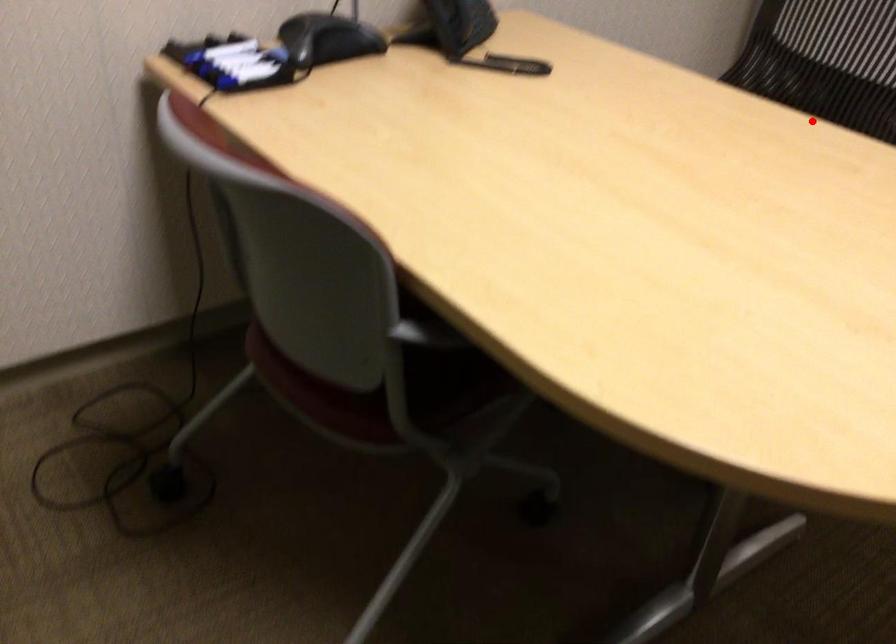
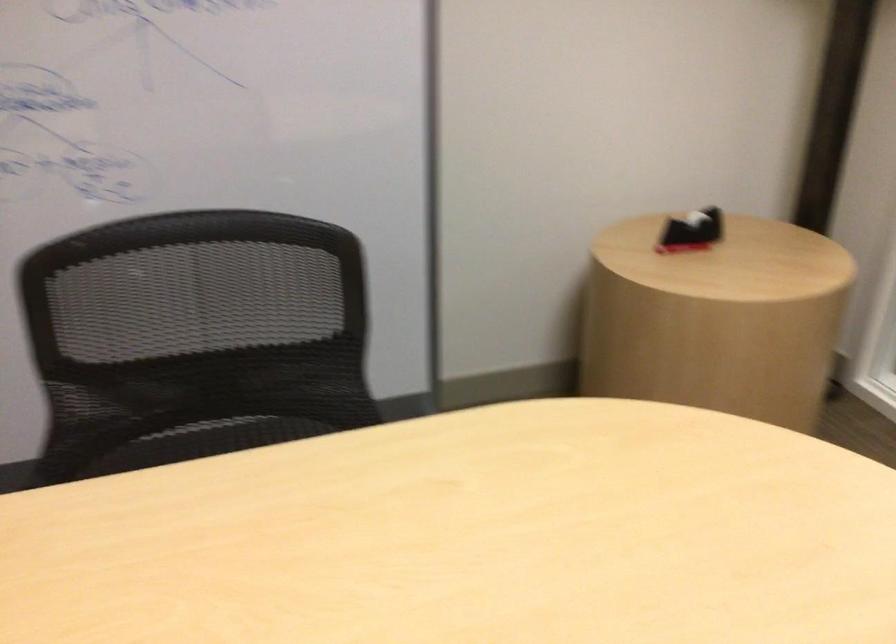
Where in the second image is the point corresponding to the highlighted location from the first image?

(218, 438)